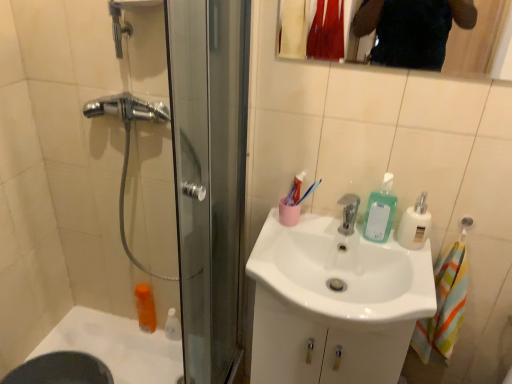
Question: From the image's perspective, does white plastic soap dispenser at upper right, placed as the first soap dispenser when sorted from right to left, appear lower than white glossy bottle at lower left?

Choices:
 (A) no
 (B) yes

Answer: (A)

Question: Is white plastic soap dispenser at upper right, placed as the first soap dispenser when sorted from right to left, closer to camera compared to white glossy bottle at lower left?

Choices:
 (A) yes
 (B) no

Answer: (A)

Question: From a real-world perspective, is white plastic soap dispenser at upper right, which ranks as the 2th soap dispenser in left-to-right order, positioned under white glossy bottle at lower left based on gravity?

Choices:
 (A) yes
 (B) no

Answer: (B)

Question: Does white plastic soap dispenser at upper right, placed as the first soap dispenser when sorted from right to left, have a greater height compared to white glossy bottle at lower left?

Choices:
 (A) no
 (B) yes

Answer: (B)

Question: Does white plastic soap dispenser at upper right, which ranks as the 2th soap dispenser in left-to-right order, have a lesser width compared to white glossy bottle at lower left?

Choices:
 (A) yes
 (B) no

Answer: (B)

Question: Considering the positions of clear glass mirror at upper center and white glossy bath at lower left in the image, is clear glass mirror at upper center taller or shorter than white glossy bath at lower left?

Choices:
 (A) tall
 (B) short

Answer: (B)

Question: From a real-world perspective, is clear glass mirror at upper center physically located above or below white glossy bath at lower left?

Choices:
 (A) below
 (B) above

Answer: (B)

Question: Is point (494, 1) positioned closer to the camera than point (98, 340)?

Choices:
 (A) farther
 (B) closer

Answer: (A)

Question: Looking at the image, does clear glass mirror at upper center seem bigger or smaller compared to white glossy bath at lower left?

Choices:
 (A) small
 (B) big

Answer: (A)

Question: Is orange plastic mouthwash at lower left inside the boundaries of white glossy bottle at lower left, or outside?

Choices:
 (A) inside
 (B) outside

Answer: (B)

Question: Is point (152, 327) positioned closer to the camera than point (176, 339)?

Choices:
 (A) closer
 (B) farther

Answer: (B)

Question: Is orange plastic mouthwash at lower left taller or shorter than white glossy bottle at lower left?

Choices:
 (A) tall
 (B) short

Answer: (A)

Question: Based on their sizes in the image, would you say orange plastic mouthwash at lower left is bigger or smaller than white glossy bottle at lower left?

Choices:
 (A) small
 (B) big

Answer: (B)

Question: Considering their positions, is orange plastic mouthwash at lower left located in front of or behind white glossy bath at lower left?

Choices:
 (A) front
 (B) behind

Answer: (B)

Question: In terms of height, does orange plastic mouthwash at lower left look taller or shorter compared to white glossy bath at lower left?

Choices:
 (A) tall
 (B) short

Answer: (B)